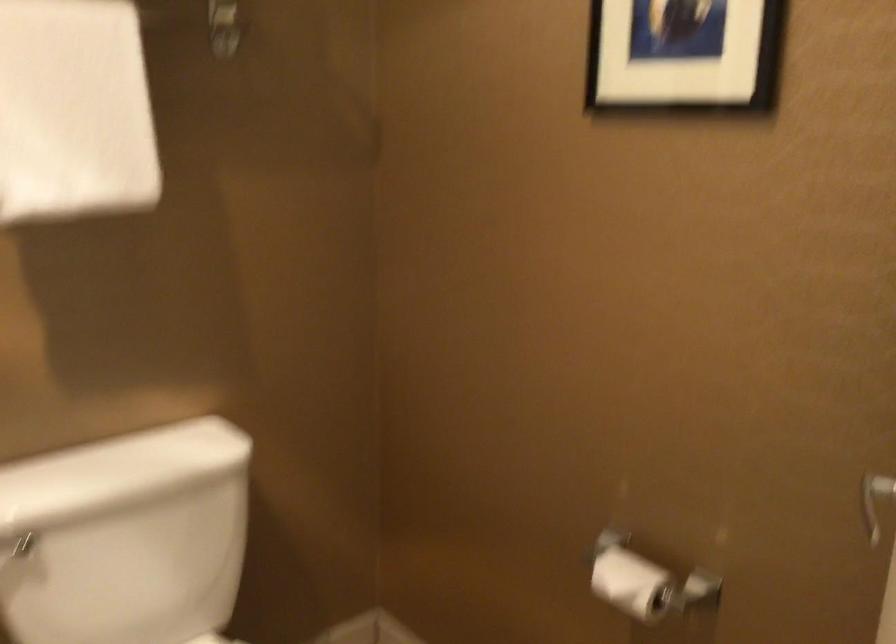
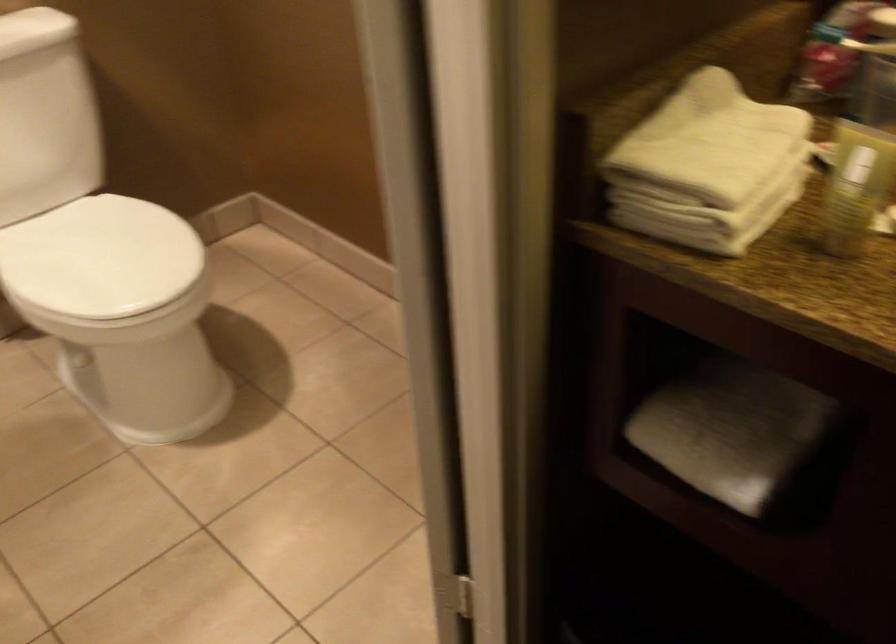
The images are taken continuously from a first-person perspective. In which direction are you moving?

The cameraman walked toward right, backward.